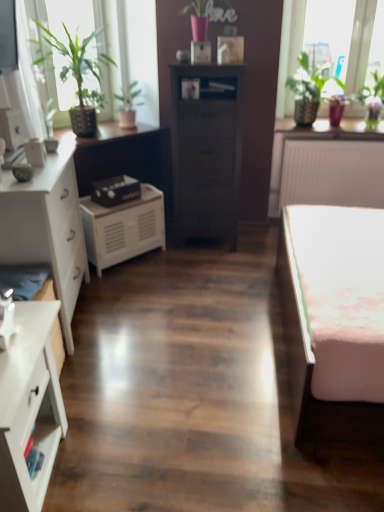
What is the approximate width of white matte radiator at upper right?

It is 24.66 inches.

Find the location of `green glossy vase at upper right`. green glossy vase at upper right is located at coordinates (371, 89).

What is the approximate width of pink fabric bed at right?

The width of pink fabric bed at right is 31.50 inches.

Locate an element on the screen. The width and height of the screenshot is (384, 512). pink fabric bed at right is located at coordinates (334, 320).

What is the approximate height of white glossy chest of drawers at lower left, placed as the 1th chest of drawers when sorted from front to back?

white glossy chest of drawers at lower left, placed as the 1th chest of drawers when sorted from front to back, is 24.66 inches tall.

In order to click on dark wood cabinet at center, the 1th chest of drawers positioned from the back in this screenshot , I will do `click(206, 150)`.

Image resolution: width=384 pixels, height=512 pixels. Find the location of `white matte radiator at upper right`. white matte radiator at upper right is located at coordinates (332, 170).

Between white matte chest of drawers at left, placed as the first chest of drawers when sorted from left to right, and green leafy plant at upper right, which one is positioned behind?

green leafy plant at upper right.

Would you consider white matte chest of drawers at left, positioned as the 2th chest of drawers in front-to-back order, to be distant from green leafy plant at upper right?

white matte chest of drawers at left, positioned as the 2th chest of drawers in front-to-back order, is far away from green leafy plant at upper right.

From a real-world perspective, is white matte chest of drawers at left, positioned as the third chest of drawers in right-to-left order, under green leafy plant at upper right?

Yes.

Is white glossy chest of drawers at lower left, which ranks as the 2th chest of drawers in right-to-left order, looking in the opposite direction of white matte radiator at upper right?

white glossy chest of drawers at lower left, which ranks as the 2th chest of drawers in right-to-left order, is not turned away from white matte radiator at upper right.

Looking at this image, from the image's perspective, which one is positioned higher, white glossy chest of drawers at lower left, placed as the 1th chest of drawers when sorted from front to back, or white matte radiator at upper right?

white matte radiator at upper right appears higher in the image.

From a real-world perspective, does white glossy chest of drawers at lower left, placed as the 1th chest of drawers when sorted from front to back, stand above white matte radiator at upper right?

No, from a real-world perspective, white glossy chest of drawers at lower left, placed as the 1th chest of drawers when sorted from front to back, is not above white matte radiator at upper right.

Considering the positions of objects white glossy chest of drawers at lower left, placed as the 1th chest of drawers when sorted from front to back, and green leafy plant at upper right in the image provided, who is in front, white glossy chest of drawers at lower left, placed as the 1th chest of drawers when sorted from front to back, or green leafy plant at upper right?

white glossy chest of drawers at lower left, placed as the 1th chest of drawers when sorted from front to back, is in front.

From a real-world perspective, is white glossy chest of drawers at lower left, positioned as the second chest of drawers in left-to-right order, positioned over green leafy plant at upper right based on gravity?

No, from a real-world perspective, white glossy chest of drawers at lower left, positioned as the second chest of drawers in left-to-right order, is not over green leafy plant at upper right

Which is nearer, (33, 327) or (353, 0)?

Point (33, 327) is closer to the camera than point (353, 0).

Is white glossy chest of drawers at lower left, which is the third chest of drawers in back-to-front order, aimed at green leafy plant at upper right?

No, white glossy chest of drawers at lower left, which is the third chest of drawers in back-to-front order, does not turn towards green leafy plant at upper right.

What's the angular difference between green glossy plant at upper right, which is counted as the 1th houseplant, starting from the right, and white matte cabinet at center's facing directions?

They differ by 50.7 degrees in their facing directions.

From a real-world perspective, which is physically below, green glossy plant at upper right, which is the 3th houseplant in left-to-right order, or white matte cabinet at center?

In real-world perspective, white matte cabinet at center is lower.

Is point (297, 104) positioned before point (158, 206)?

That is False.

Which of these two, green glossy plant at upper right, which is the 3th houseplant in left-to-right order, or white matte cabinet at center, stands shorter?

With less height is white matte cabinet at center.

Is green matte plant at upper left, which appears as the second houseplant when viewed from the left, thinner than green glossy plant at upper right, which is counted as the 1th houseplant, starting from the right?

No, green matte plant at upper left, which appears as the second houseplant when viewed from the left, is not thinner than green glossy plant at upper right, which is counted as the 1th houseplant, starting from the right.

Can you tell me how much green matte plant at upper left, which is the second houseplant from right to left, and green glossy plant at upper right, which is counted as the 1th houseplant, starting from the right, differ in facing direction?

They differ by 50.7 degrees in their facing directions.

Considering the sizes of green matte plant at upper left, which appears as the second houseplant when viewed from the left, and green glossy plant at upper right, which is the 3th houseplant in left-to-right order, in the image, is green matte plant at upper left, which appears as the second houseplant when viewed from the left, bigger or smaller than green glossy plant at upper right, which is the 3th houseplant in left-to-right order,?

In the image, green matte plant at upper left, which appears as the second houseplant when viewed from the left, appears to be smaller than green glossy plant at upper right, which is the 3th houseplant in left-to-right order.

Is there a large distance between green matte plant at upper left, which appears as the second houseplant when viewed from the left, and green glossy plant at upper right, which is the 3th houseplant in left-to-right order?

Indeed, green matte plant at upper left, which appears as the second houseplant when viewed from the left, is not near green glossy plant at upper right, which is the 3th houseplant in left-to-right order.

Is dark wood cabinet at center, arranged as the third chest of drawers when viewed from the front, situated inside green leafy plant at upper right or outside?

dark wood cabinet at center, arranged as the third chest of drawers when viewed from the front, cannot be found inside green leafy plant at upper right.

Identify the location of the 1st chest of drawers to the left of the green leafy plant at upper right, starting your count from the anchor. This screenshot has height=512, width=384. (206, 150).

From the image's perspective, would you say dark wood cabinet at center, arranged as the third chest of drawers when viewed from the front, is shown under green leafy plant at upper right?

Yes, from the image's perspective, dark wood cabinet at center, arranged as the third chest of drawers when viewed from the front, is below green leafy plant at upper right.

In the scene shown: Which object is wider, dark wood cabinet at center, the first chest of drawers from the right, or green leafy plant at upper right?

dark wood cabinet at center, the first chest of drawers from the right.

Considering the sizes of objects white matte radiator at upper right and white matte cabinet at center in the image provided, who is smaller, white matte radiator at upper right or white matte cabinet at center?

white matte cabinet at center is smaller.

Is white matte radiator at upper right positioned with its back to white matte cabinet at center?

No, white matte radiator at upper right's orientation is not away from white matte cabinet at center.

From a real-world perspective, relative to white matte cabinet at center, is white matte radiator at upper right vertically above or below?

white matte radiator at upper right is above white matte cabinet at center.

In the scene shown: Is white matte radiator at upper right surrounding white matte cabinet at center?

Definitely not — white matte cabinet at center is not inside white matte radiator at upper right.

The image size is (384, 512). In order to click on window behind the white matte chest of drawers at left, placed as the first chest of drawers when sorted from left to right in this screenshot , I will do `click(332, 38)`.

This screenshot has height=512, width=384. I want to click on the 2nd chest of drawers to the left of the white matte radiator at upper right, starting your count from the anchor, so click(29, 406).

From the image, which object appears to be nearer to pink fabric bed at right, white matte radiator at upper right or green glossy plant at upper right, which is the 3th houseplant in left-to-right order?

white matte radiator at upper right is closer to pink fabric bed at right.

Which object lies further to the anchor point white matte radiator at upper right, green glossy plant at upper right, which is the 3th houseplant in left-to-right order, or dark wood cabinet at center, the first chest of drawers from the right?

dark wood cabinet at center, the first chest of drawers from the right, is positioned further to the anchor white matte radiator at upper right.

Considering their positions, is white matte chest of drawers at left, placed as the first chest of drawers when sorted from left to right, positioned further to pink fabric bed at right than dark wood cabinet at center, the 1th chest of drawers positioned from the back?

Based on the image, white matte chest of drawers at left, placed as the first chest of drawers when sorted from left to right, appears to be further to pink fabric bed at right.

From the image, which object appears to be nearer to white matte radiator at upper right, white matte chest of drawers at left, positioned as the 2th chest of drawers in front-to-back order, or pink fabric bed at right?

pink fabric bed at right lies closer to white matte radiator at upper right than the other object.

Considering their positions, is pink fabric bed at right positioned closer to green leafy plant at upper left, the third houseplant positioned from the right, than white matte cabinet at center?

white matte cabinet at center is closer to green leafy plant at upper left, the third houseplant positioned from the right.

Considering their positions, is green glossy plant at upper right, which is counted as the 1th houseplant, starting from the right, positioned further to green leafy plant at upper left, the third houseplant positioned from the right, than white matte chest of drawers at left, which ranks as the 2th chest of drawers in back-to-front order?

green glossy plant at upper right, which is counted as the 1th houseplant, starting from the right.

Considering their positions, is green leafy plant at upper right positioned further to green glossy vase at upper right than green leafy plant at upper left, which is the 1th houseplant in left-to-right order?

The object further to green glossy vase at upper right is green leafy plant at upper left, which is the 1th houseplant in left-to-right order.

Which object lies further to the anchor point green matte plant at upper left, which is the second houseplant from right to left, white matte cabinet at center or white matte chest of drawers at left, positioned as the third chest of drawers in right-to-left order?

white matte chest of drawers at left, positioned as the third chest of drawers in right-to-left order, is further to green matte plant at upper left, which is the second houseplant from right to left.

The width and height of the screenshot is (384, 512). I want to click on bed located between white matte chest of drawers at left, placed as the first chest of drawers when sorted from left to right, and green glossy vase at upper right in the left-right direction, so click(334, 320).

Locate an element on the screen. This screenshot has height=512, width=384. cabinetry between pink fabric bed at right and green leafy plant at upper right along the z-axis is located at coordinates (123, 228).

Where is `bed between green leafy plant at upper left, the third houseplant positioned from the right, and green glossy vase at upper right`? This screenshot has width=384, height=512. bed between green leafy plant at upper left, the third houseplant positioned from the right, and green glossy vase at upper right is located at coordinates (334, 320).

Find the location of `houseplant between green leafy plant at upper left, which is the 1th houseplant in left-to-right order, and dark wood cabinet at center, arranged as the third chest of drawers when viewed from the front`. houseplant between green leafy plant at upper left, which is the 1th houseplant in left-to-right order, and dark wood cabinet at center, arranged as the third chest of drawers when viewed from the front is located at coordinates (128, 104).